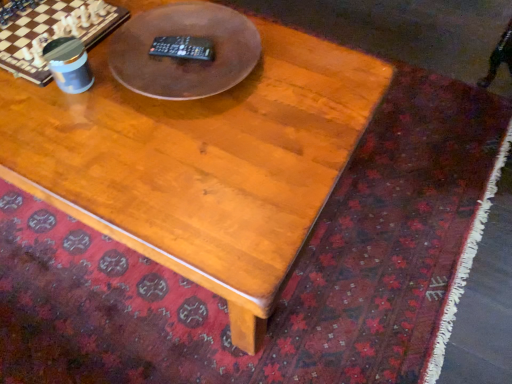
Locate an element on the screen. This screenshot has height=384, width=512. free location in front of brown wooden table at center is located at coordinates [x=179, y=173].